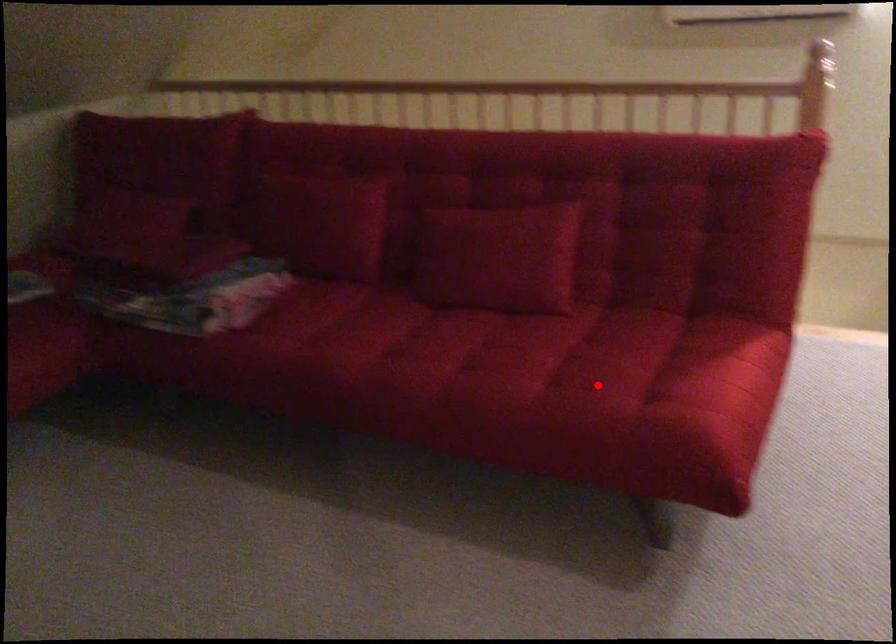
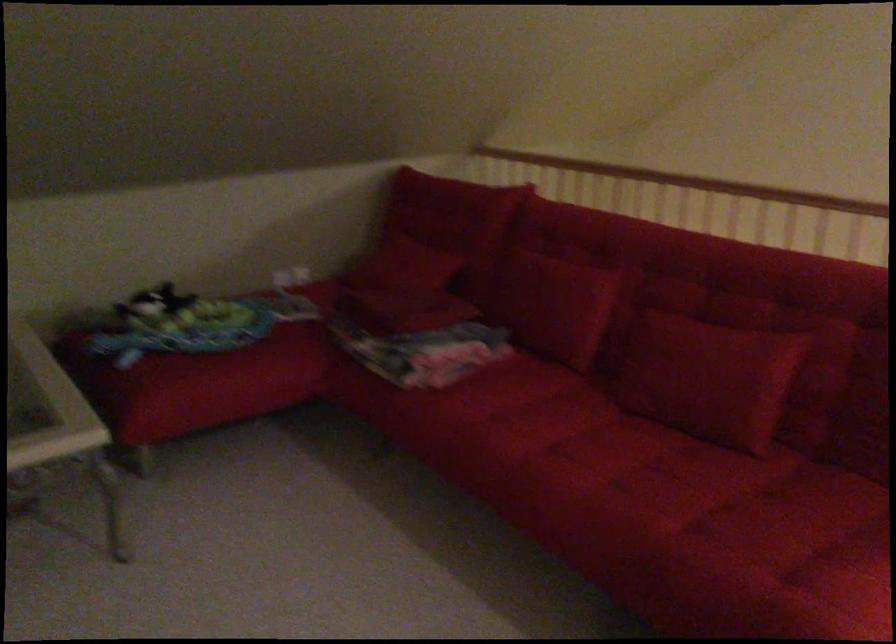
Question: I am providing you with two images of the same scene from different viewpoints. A red point is shown in image1. For the corresponding object point in image2, is it positioned nearer or farther from the camera?

Choices:
 (A) Nearer
 (B) Farther

Answer: (A)